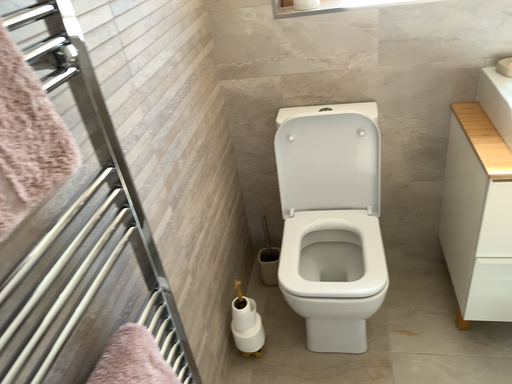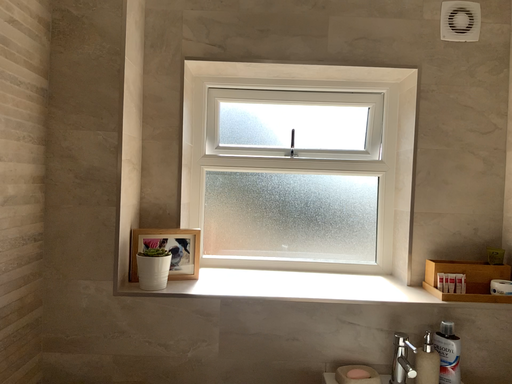
Question: How did the camera likely rotate when shooting the video?

Choices:
 (A) rotated downward
 (B) rotated upward

Answer: (B)